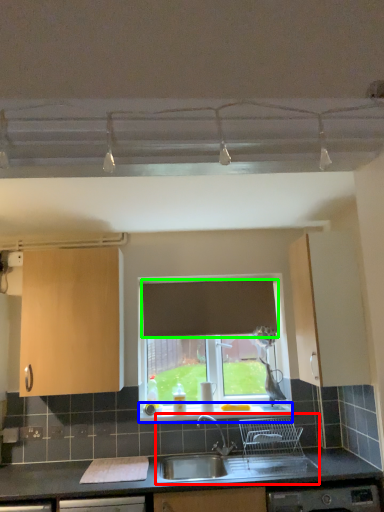
Question: Based on their relative distances, which object is nearer to sink (highlighted by a red box)? Choose from window sill (highlighted by a blue box) and curtain (highlighted by a green box).

Choices:
 (A) window sill
 (B) curtain

Answer: (A)